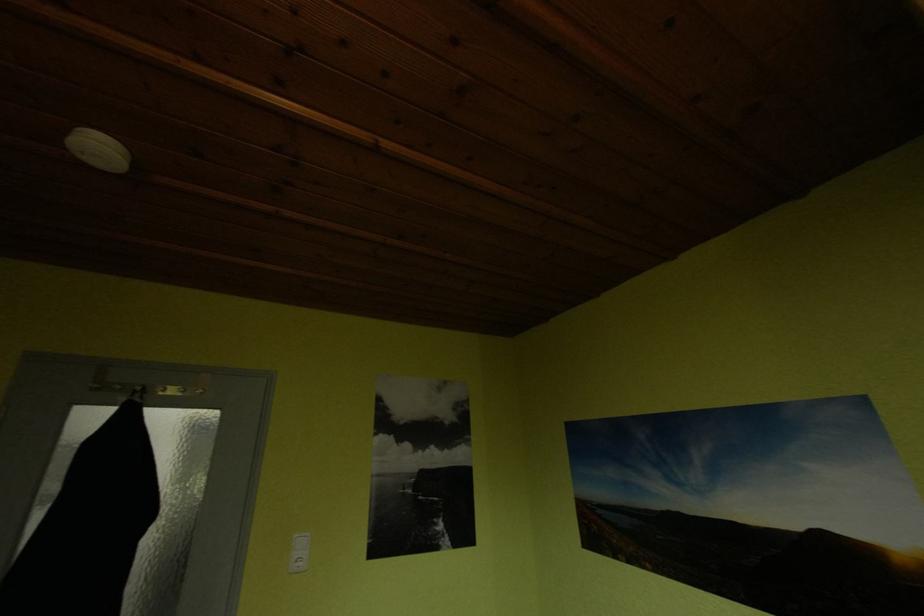
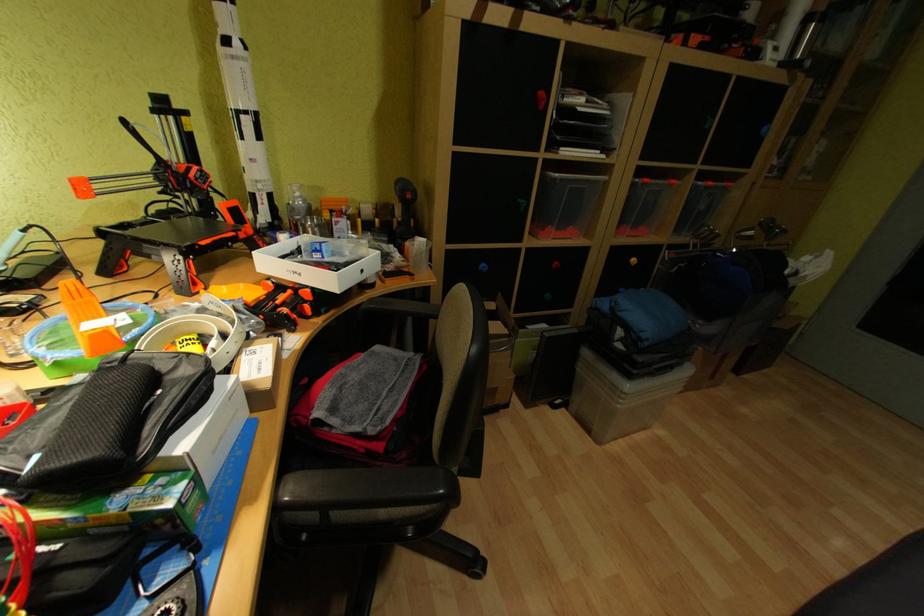
First-person continuous shooting, in which direction is the camera rotating?

The camera's rotation is toward left-down.